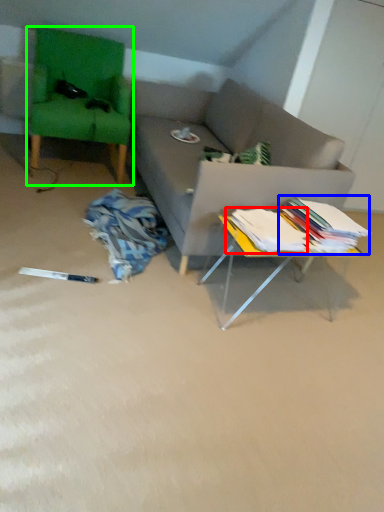
Question: Which is nearer to the book (highlighted by a red box)? book (highlighted by a blue box) or swivel chair (highlighted by a green box).

Choices:
 (A) book
 (B) swivel chair

Answer: (A)